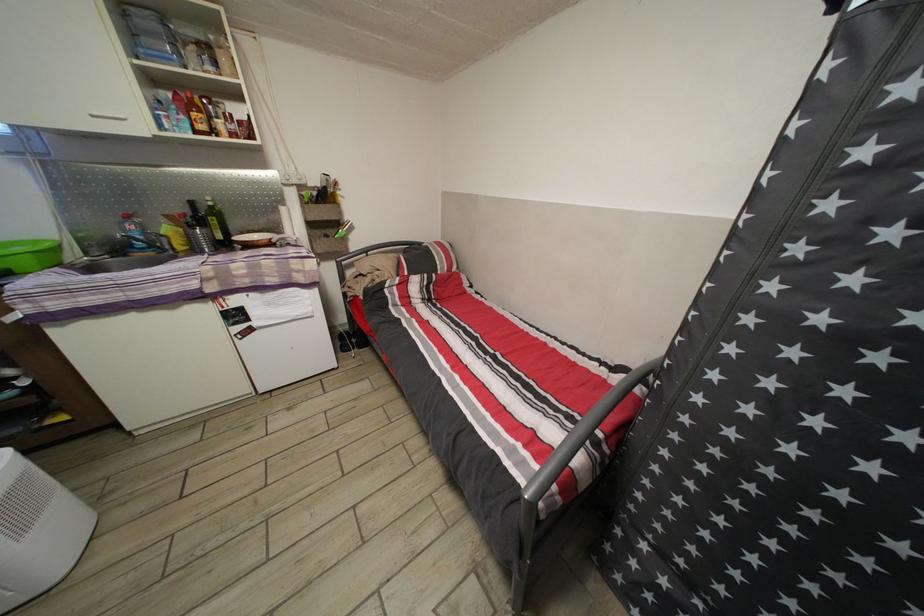
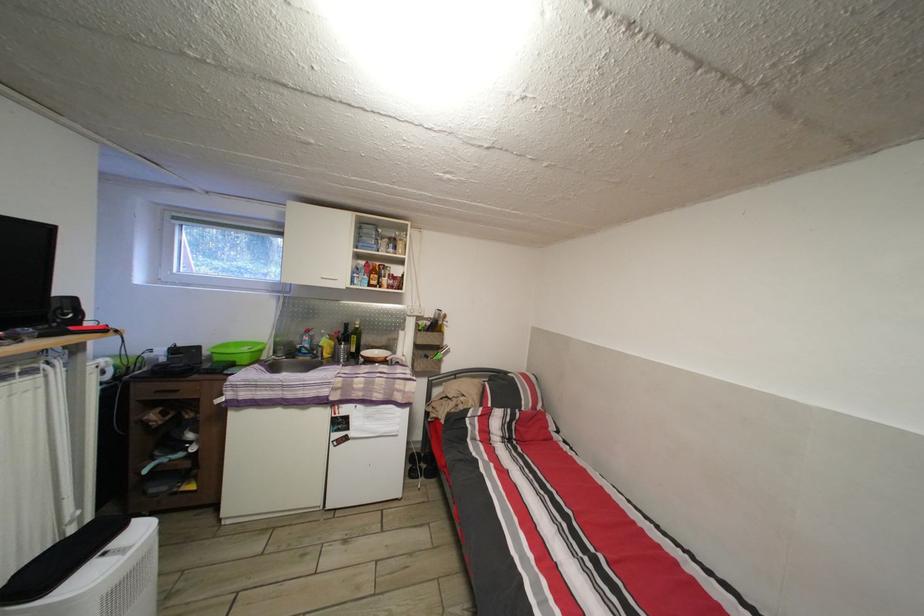
The first image is from the beginning of the video and the second image is from the end. How did the camera likely rotate when shooting the video?

The rotation direction of the camera is left-up.